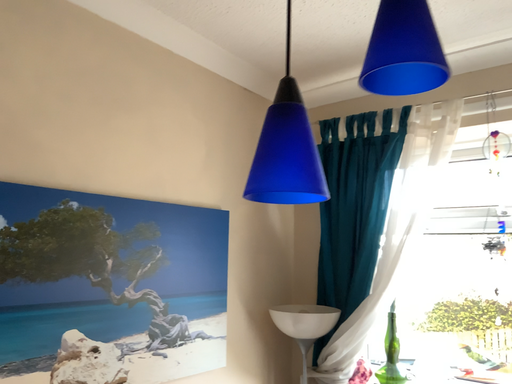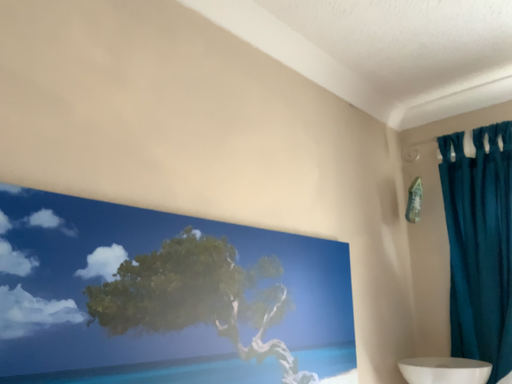
Question: Which way did the camera rotate in the video?

Choices:
 (A) rotated upward
 (B) rotated downward

Answer: (A)